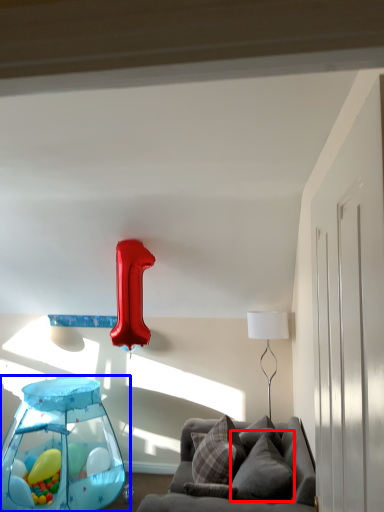
Question: Among these objects, which one is farthest to the camera, pillow (highlighted by a red box) or baby carriage (highlighted by a blue box)?

Choices:
 (A) pillow
 (B) baby carriage

Answer: (B)